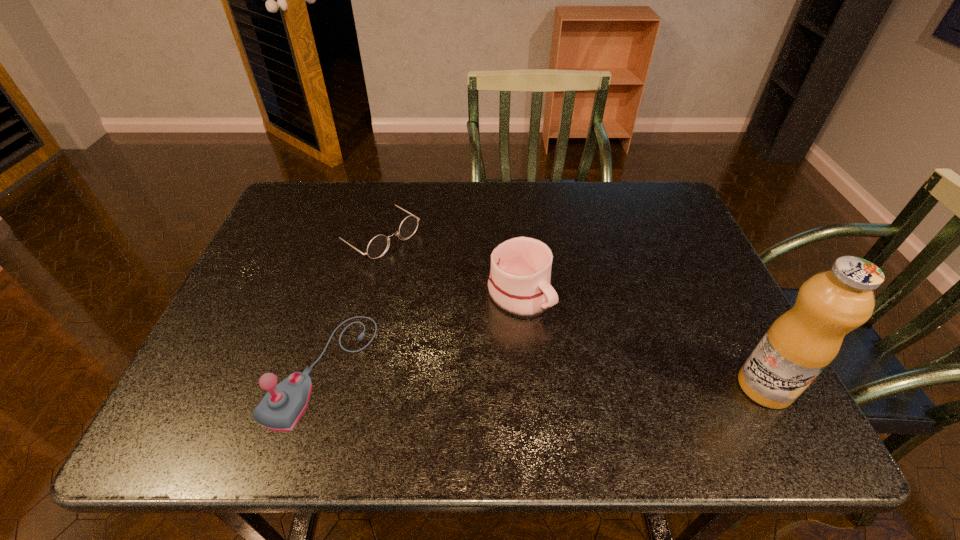
Identify the location of joystick. (281, 408).

Find the location of a particular element. This screenshot has height=540, width=960. the tallest object is located at coordinates (802, 342).

Locate an element on the screen. The height and width of the screenshot is (540, 960). the rightmost object is located at coordinates (802, 342).

Identify the location of mug. (519, 283).

Identify the location of the farthest object. (376, 248).

I want to click on spectacles, so click(x=376, y=248).

Find the location of a particular element. free location located on the back of the joystick is located at coordinates (348, 280).

The height and width of the screenshot is (540, 960). What are the coordinates of `free space located 0.240m on the side with the handle of the second object from right to left` in the screenshot? It's located at pyautogui.click(x=615, y=395).

Identify the location of vacant space situated on the side with the handle of the second object from right to left. The width and height of the screenshot is (960, 540). (560, 338).

Identify the location of vacant area situated 0.130m on the side with the handle of the second object from right to left. [x=578, y=357].